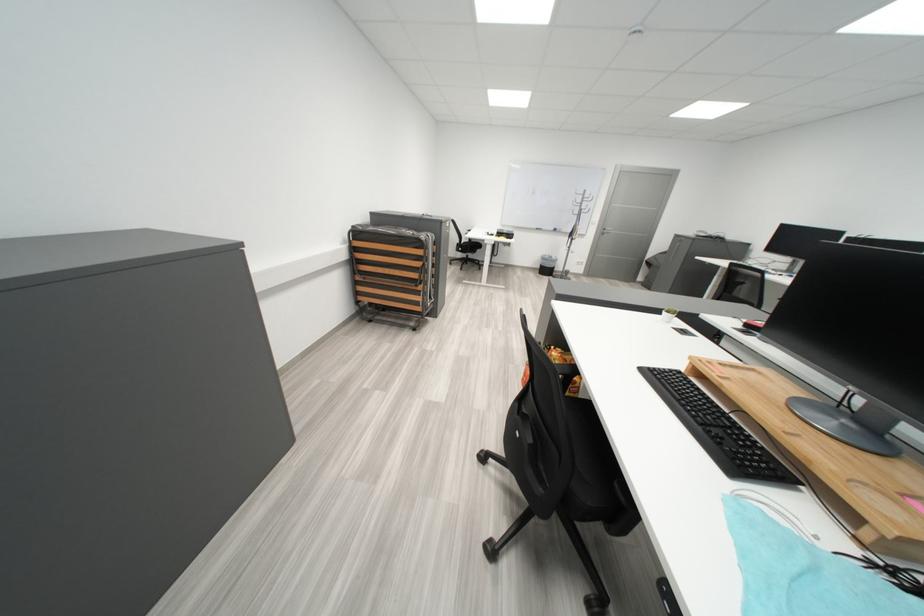
This screenshot has height=616, width=924. What do you see at coordinates (587, 432) in the screenshot?
I see `the black chair surface` at bounding box center [587, 432].